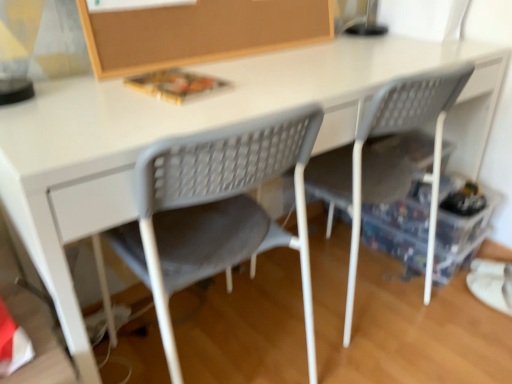
You are a GUI agent. You are given a task and a screenshot of the screen. Output one action in this format:
    pyautogui.click(x=<x>, y=<y>)
    Task: Click on the empty space that is to the right of gray plastic chair at center, which appears as the 1th chair when viewed from the right
    The height and width of the screenshot is (384, 512).
    Given the screenshot: What is the action you would take?
    pyautogui.click(x=442, y=312)